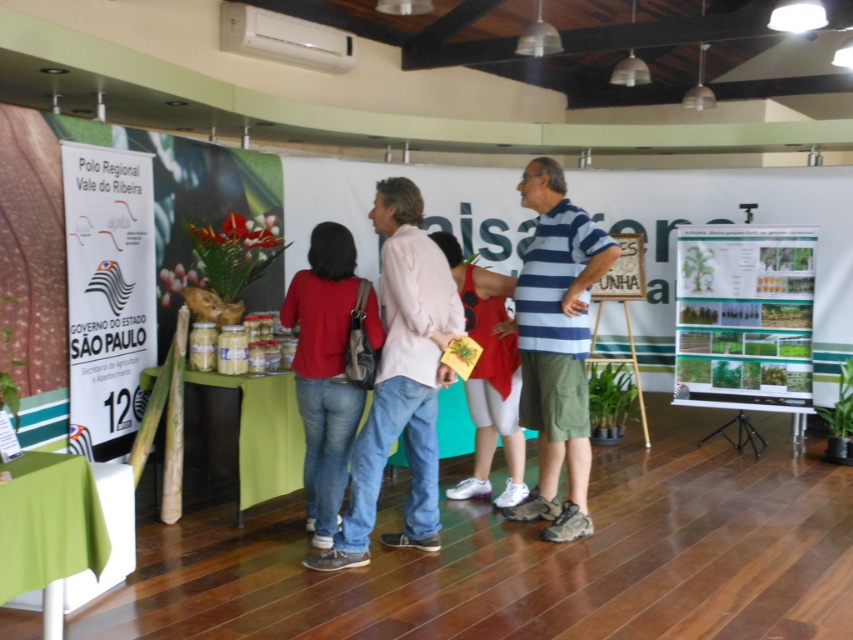
Question: Does striped cotton shirt at center have a lesser width compared to white fabric dress at center?

Choices:
 (A) no
 (B) yes

Answer: (B)

Question: Which object is closer to the camera taking this photo?

Choices:
 (A) denim jeans at center
 (B) white fabric dress at center
 (C) matte red shirt at center
 (D) striped cotton shirt at center

Answer: (A)

Question: Based on their relative distances, which object is nearer to the striped cotton shirt at center?

Choices:
 (A) denim jeans at center
 (B) white fabric dress at center

Answer: (B)

Question: From the image, what is the correct spatial relationship of striped cotton shirt at center in relation to matte red shirt at center?

Choices:
 (A) below
 (B) above

Answer: (B)

Question: Which point is farther to the camera?

Choices:
 (A) matte red shirt at center
 (B) white fabric dress at center
 (C) green matte poster at upper center
 (D) striped cotton shirt at center

Answer: (C)

Question: Observing the image, what is the correct spatial positioning of denim jeans at center in reference to matte red shirt at center?

Choices:
 (A) below
 (B) above

Answer: (B)